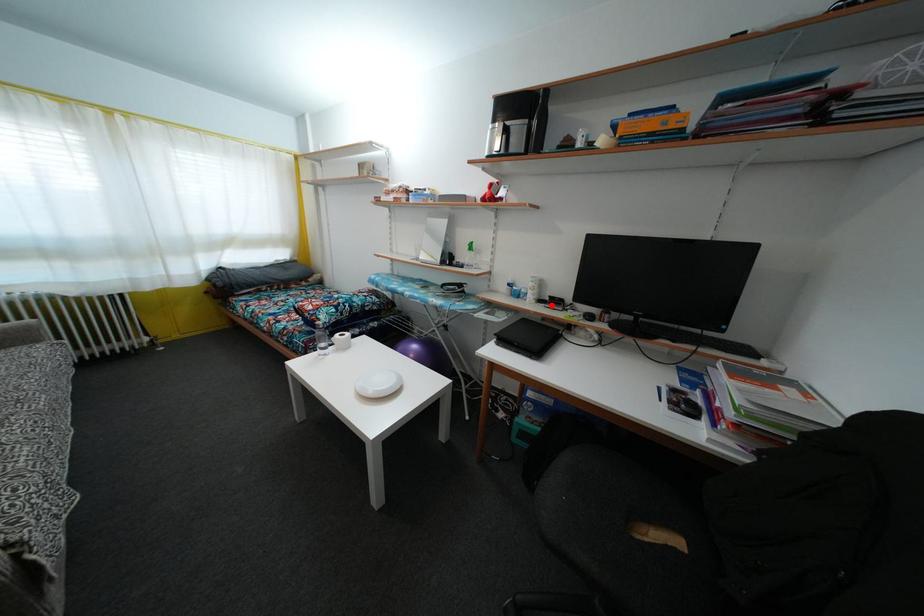
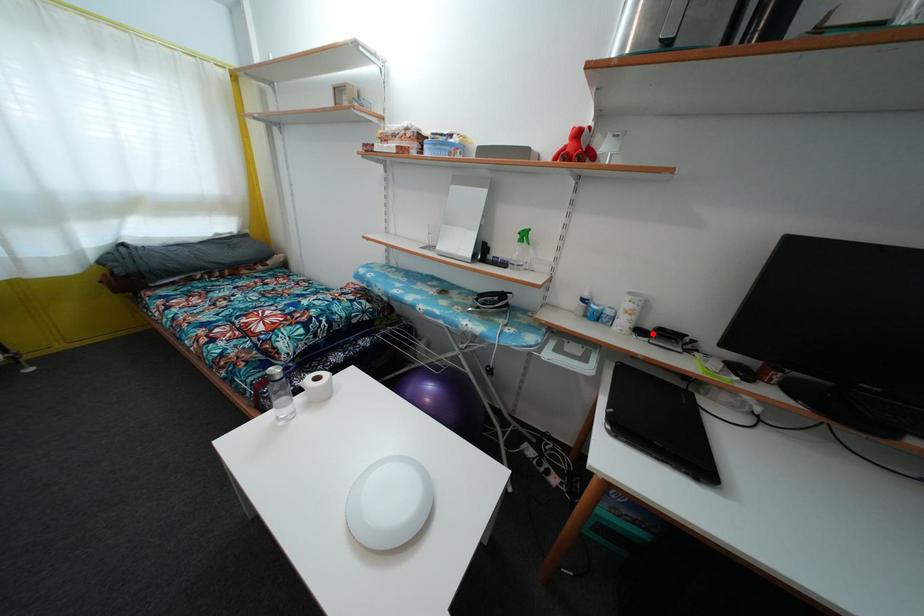
I am providing you with two images of the same scene from different viewpoints. A red point is marked on the first image and another point is marked on the second image. Is the red point in image1 aligned with the point shown in image2?

Yes